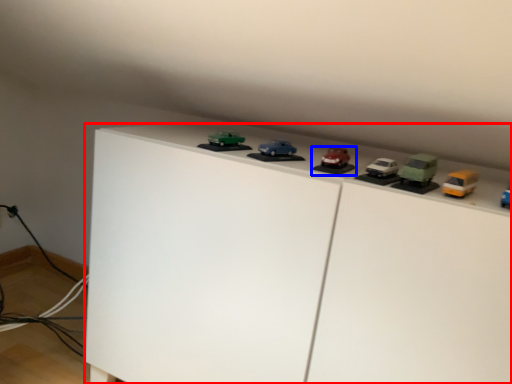
Question: Which point is closer to the camera, furniture (highlighted by a red box) or toy (highlighted by a blue box)?

Choices:
 (A) furniture
 (B) toy

Answer: (A)